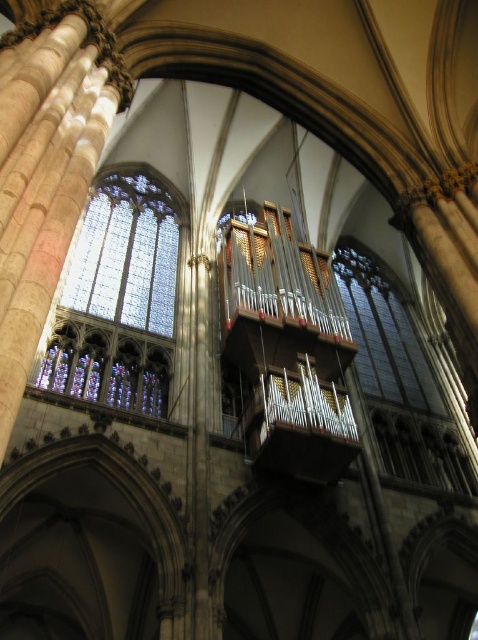
Question: Is stained glass at center thinner than clear glass window at center?

Choices:
 (A) no
 (B) yes

Answer: (A)

Question: Which point is farther to the camera?

Choices:
 (A) (337, 260)
 (B) (327, 465)

Answer: (A)

Question: Which of the following is the farthest from the observer?

Choices:
 (A) stained glass at center
 (B) metallic pipes at center
 (C) clear glass window at center

Answer: (C)

Question: Does metallic pipes at center have a smaller size compared to stained glass at center?

Choices:
 (A) no
 (B) yes

Answer: (A)

Question: Can you confirm if stained glass at center is positioned below clear glass window at center?

Choices:
 (A) yes
 (B) no

Answer: (B)

Question: Which of the following is the farthest from the observer?

Choices:
 (A) stained glass at center
 (B) clear glass window at center

Answer: (B)